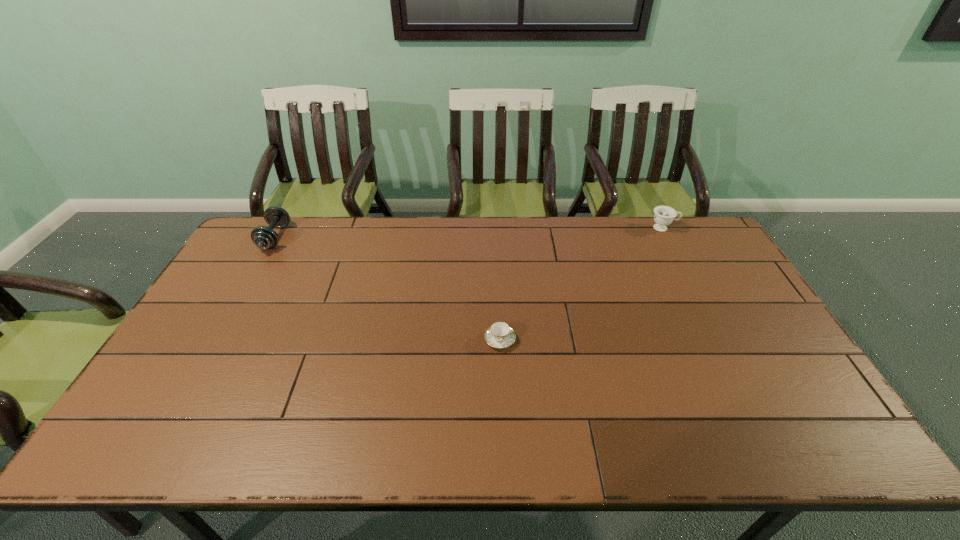
The width and height of the screenshot is (960, 540). I want to click on teacup that is at the far edge, so click(664, 215).

Locate an element on the screen. The image size is (960, 540). object that is positioned at the left edge is located at coordinates (263, 237).

Locate an element on the screen. object that is at the right edge is located at coordinates (664, 215).

The height and width of the screenshot is (540, 960). In order to click on object that is at the far left corner in this screenshot , I will do `click(263, 237)`.

Locate an element on the screen. This screenshot has height=540, width=960. object that is at the far right corner is located at coordinates (664, 215).

Where is `vacant space at the far edge of the desktop`? The image size is (960, 540). vacant space at the far edge of the desktop is located at coordinates (416, 253).

Where is `vacant region at the near edge of the desktop`? Image resolution: width=960 pixels, height=540 pixels. vacant region at the near edge of the desktop is located at coordinates (240, 437).

The width and height of the screenshot is (960, 540). Find the location of `vacant region at the left edge of the desktop`. vacant region at the left edge of the desktop is located at coordinates (233, 316).

Find the location of a particular element. The height and width of the screenshot is (540, 960). free spot at the far left corner of the desktop is located at coordinates (290, 230).

I want to click on unoccupied area between the nearer teacup and the farther teacup, so click(x=582, y=284).